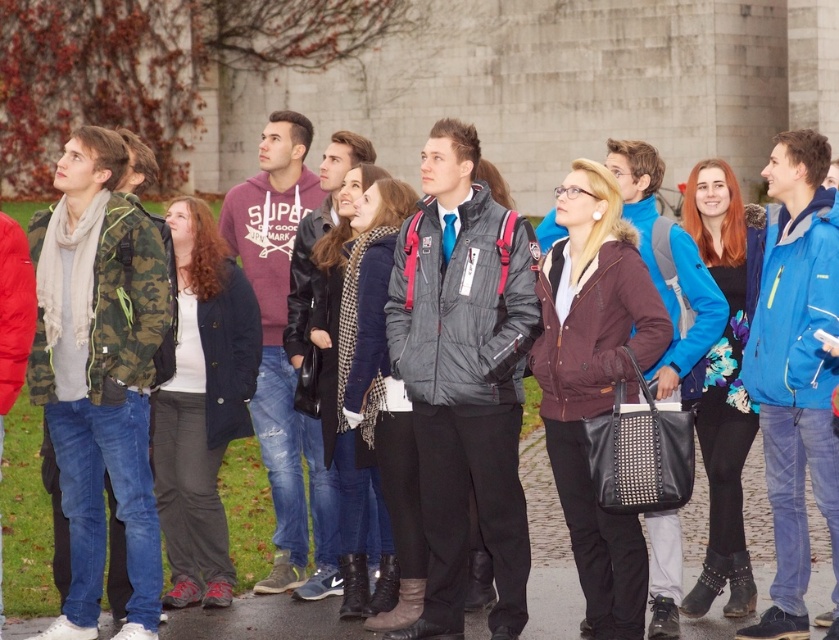
Who is more distant from viewer, (x=593, y=522) or (x=751, y=241)?

Point (x=751, y=241)

Is burgundy leather jacket at center further to camera compared to floral-patterned top at center?

No, it is not.

Between point (577, 548) and point (707, 396), which one is positioned behind?

Positioned behind is point (707, 396).

Image resolution: width=839 pixels, height=640 pixels. What are the coordinates of `burgundy leather jacket at center` in the screenshot? It's located at (595, 381).

Does dark blue cotton jacket at center have a smaller size compared to floral-patterned top at center?

Yes.

Can you confirm if dark blue cotton jacket at center is thinner than floral-patterned top at center?

Indeed, dark blue cotton jacket at center has a lesser width compared to floral-patterned top at center.

Find the location of a particular element. The width and height of the screenshot is (839, 640). dark blue cotton jacket at center is located at coordinates (202, 404).

Does point (632, 308) come in front of point (180, 340)?

Yes, it is.

Does burgundy leather jacket at center have a smaller size compared to dark blue cotton jacket at center?

No, burgundy leather jacket at center is not smaller than dark blue cotton jacket at center.

Describe the element at coordinates (595, 381) in the screenshot. I see `burgundy leather jacket at center` at that location.

Find the location of `burgundy leather jacket at center`. burgundy leather jacket at center is located at coordinates (595, 381).